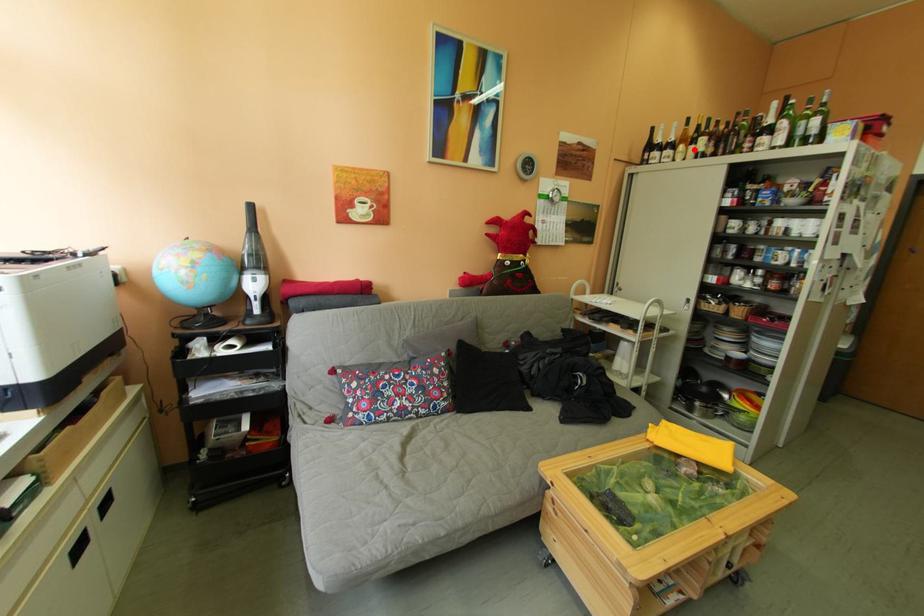
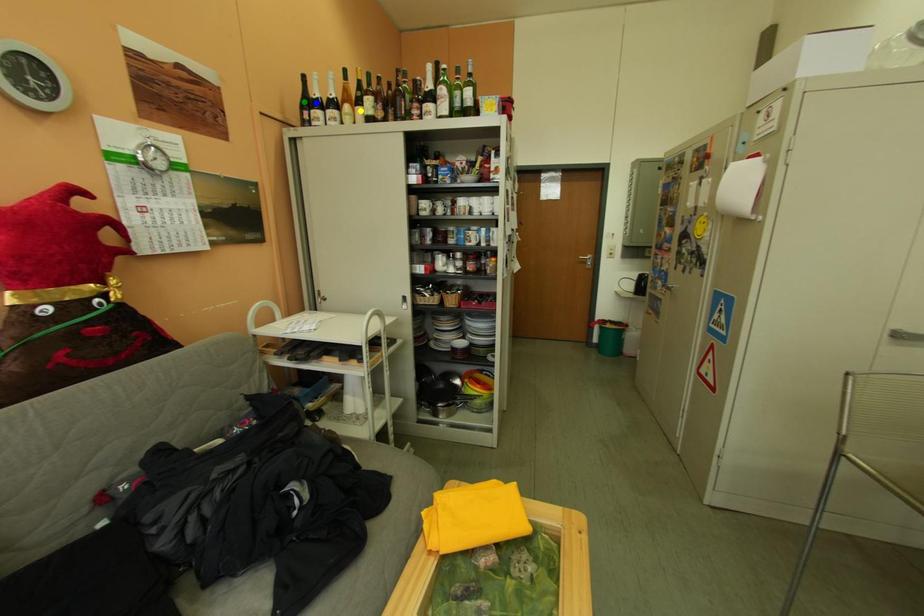
Question: I am providing you with two images of the same scene from different viewpoints. A red point is marked on the first image. You are given multiple points on the second image. Which point in image 2 represents the same 3d spot as the red point in image 1?

Choices:
 (A) green point
 (B) yellow point
 (C) blue point

Answer: (B)